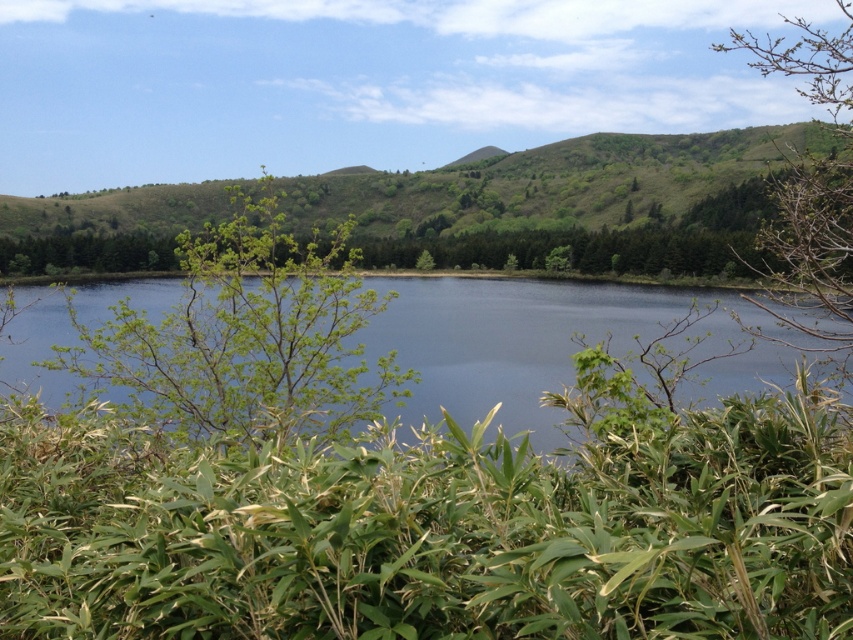
You are standing at the edge of the lake and want to take a photo of the green leafy tree at center and the transparent blue water at center. Which object will appear closer to you in the photo?

The green leafy tree at center will appear closer to you in the photo because it is positioned closer to the viewer than the transparent blue water at center.

You are standing at the edge of the lake and see the transparent blue water at center and the green leafy tree at upper right. Which object is closer to the horizon?

The green leafy tree at upper right is closer to the horizon because it is positioned above the transparent blue water at center, which is located below it.

You are standing at the edge of the lake and see the green leafy tree at center and the transparent blue water at center. Which object is positioned to the right side?

The green leafy tree at center is positioned to the right of the transparent blue water at center.